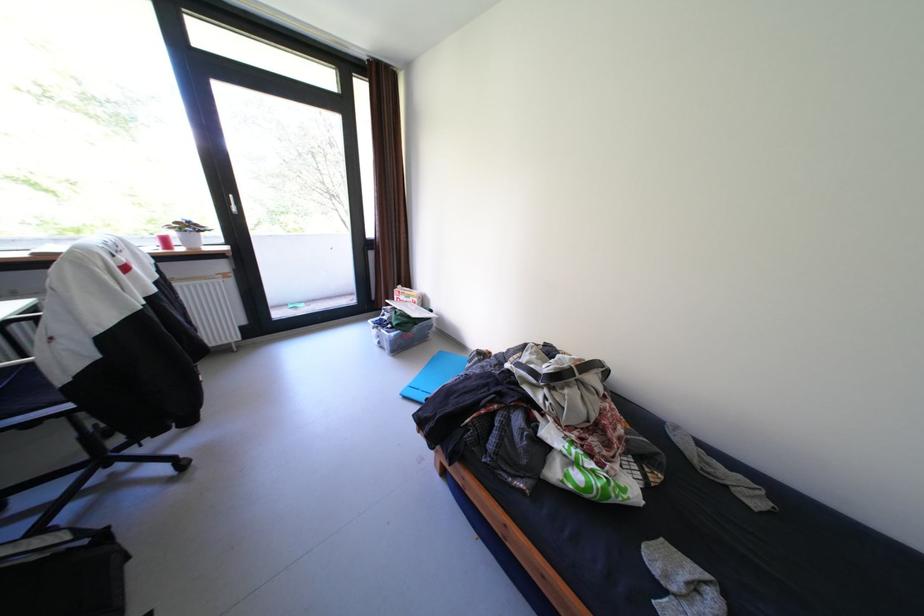
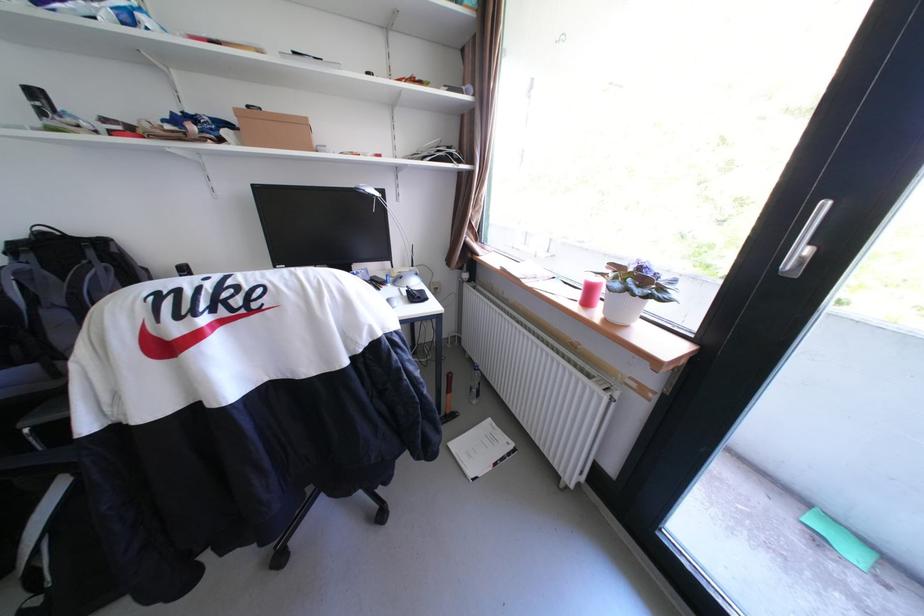
The point at (191,249) is marked in the first image. Where is the corresponding point in the second image?

(608, 313)